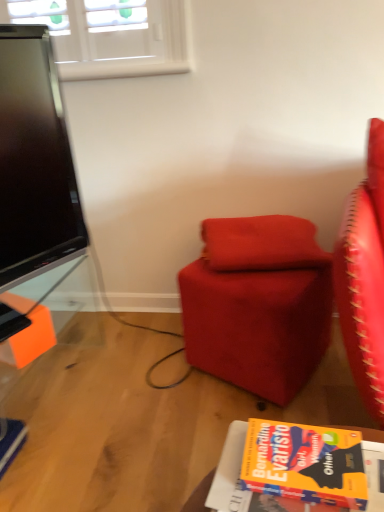
I want to click on vacant area on top of orange matte book at lower right (from a real-world perspective), so click(x=309, y=461).